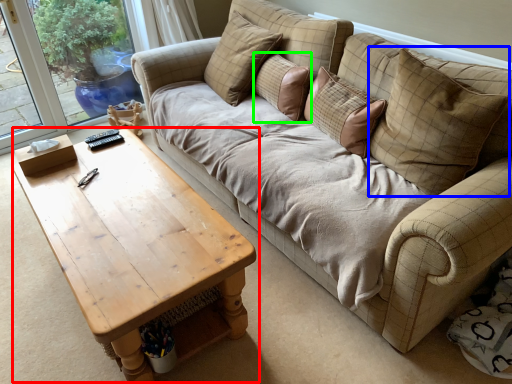
Question: Which object is the farthest from coffee table (highlighted by a red box)? Choose among these: pillow (highlighted by a blue box) or pillow (highlighted by a green box).

Choices:
 (A) pillow
 (B) pillow

Answer: (B)